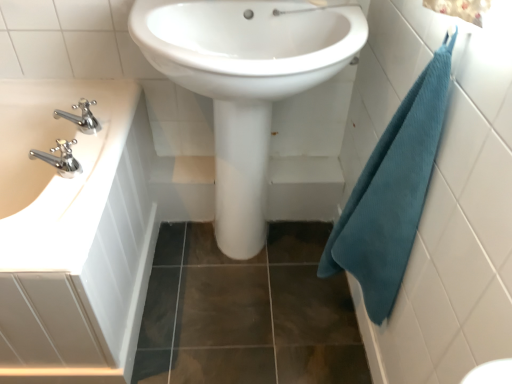
Question: Considering the relative sizes of white glossy sink at left, placed as the first sink when sorted from left to right, and white glossy sink at center, positioned as the second sink in left-to-right order, in the image provided, is white glossy sink at left, placed as the first sink when sorted from left to right, wider than white glossy sink at center, positioned as the second sink in left-to-right order,?

Choices:
 (A) no
 (B) yes

Answer: (B)

Question: Is white glossy sink at left, which ranks as the 2th sink in right-to-left order, behind white glossy sink at center, marked as the first sink in a right-to-left arrangement?

Choices:
 (A) yes
 (B) no

Answer: (B)

Question: From the image's perspective, would you say white glossy sink at left, placed as the first sink when sorted from left to right, is shown under white glossy sink at center, marked as the first sink in a right-to-left arrangement?

Choices:
 (A) no
 (B) yes

Answer: (B)

Question: Is white glossy sink at left, placed as the first sink when sorted from left to right, looking in the opposite direction of white glossy sink at center, positioned as the second sink in left-to-right order?

Choices:
 (A) yes
 (B) no

Answer: (B)

Question: From the image's perspective, is white glossy sink at left, which ranks as the 2th sink in right-to-left order, on top of white glossy sink at center, positioned as the second sink in left-to-right order?

Choices:
 (A) yes
 (B) no

Answer: (B)

Question: From their relative heights in the image, would you say chrome metallic faucet at left is taller or shorter than teal waffle towel at right?

Choices:
 (A) short
 (B) tall

Answer: (A)

Question: Is chrome metallic faucet at left bigger or smaller than teal waffle towel at right?

Choices:
 (A) small
 (B) big

Answer: (A)

Question: Considering their positions, is chrome metallic faucet at left located in front of or behind teal waffle towel at right?

Choices:
 (A) front
 (B) behind

Answer: (B)

Question: Would you say chrome metallic faucet at left is inside or outside teal waffle towel at right?

Choices:
 (A) inside
 (B) outside

Answer: (B)

Question: Considering their positions, is chrome metallic faucet at left located in front of or behind white glossy sink at center, marked as the first sink in a right-to-left arrangement?

Choices:
 (A) front
 (B) behind

Answer: (B)

Question: From their relative heights in the image, would you say chrome metallic faucet at left is taller or shorter than white glossy sink at center, positioned as the second sink in left-to-right order?

Choices:
 (A) short
 (B) tall

Answer: (A)

Question: Is point (88, 132) positioned closer to the camera than point (259, 221)?

Choices:
 (A) closer
 (B) farther

Answer: (A)

Question: Based on their positions, is chrome metallic faucet at left located to the left or right of white glossy sink at center, positioned as the second sink in left-to-right order?

Choices:
 (A) right
 (B) left

Answer: (B)

Question: From their relative heights in the image, would you say white glossy sink at center, marked as the first sink in a right-to-left arrangement, is taller or shorter than teal waffle towel at right?

Choices:
 (A) short
 (B) tall

Answer: (B)

Question: Based on their sizes in the image, would you say white glossy sink at center, marked as the first sink in a right-to-left arrangement, is bigger or smaller than teal waffle towel at right?

Choices:
 (A) small
 (B) big

Answer: (B)